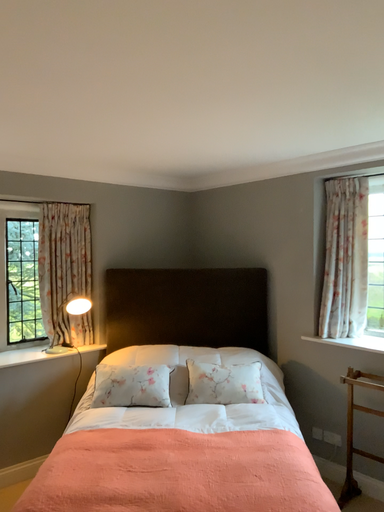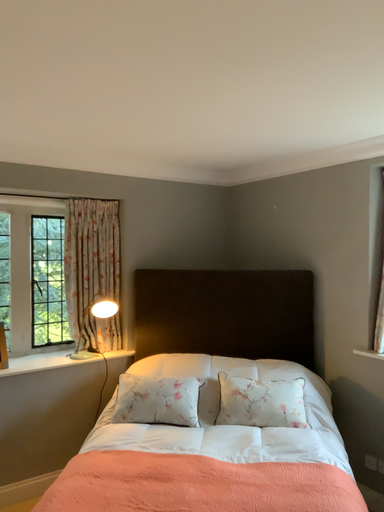
Question: Which way did the camera rotate in the video?

Choices:
 (A) rotated left
 (B) rotated right

Answer: (A)